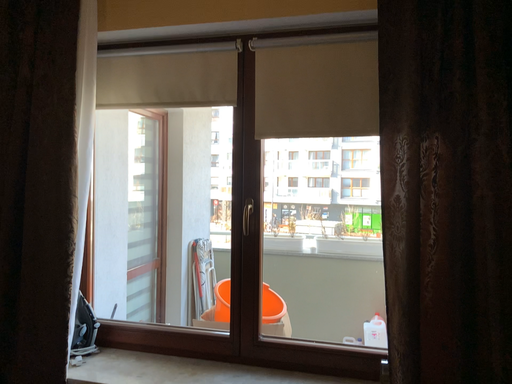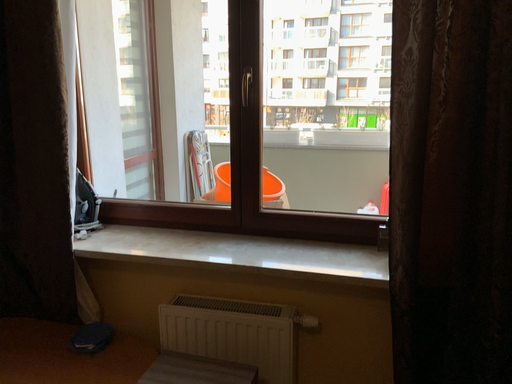
Question: How did the camera likely rotate when shooting the video?

Choices:
 (A) rotated upward
 (B) rotated downward

Answer: (B)